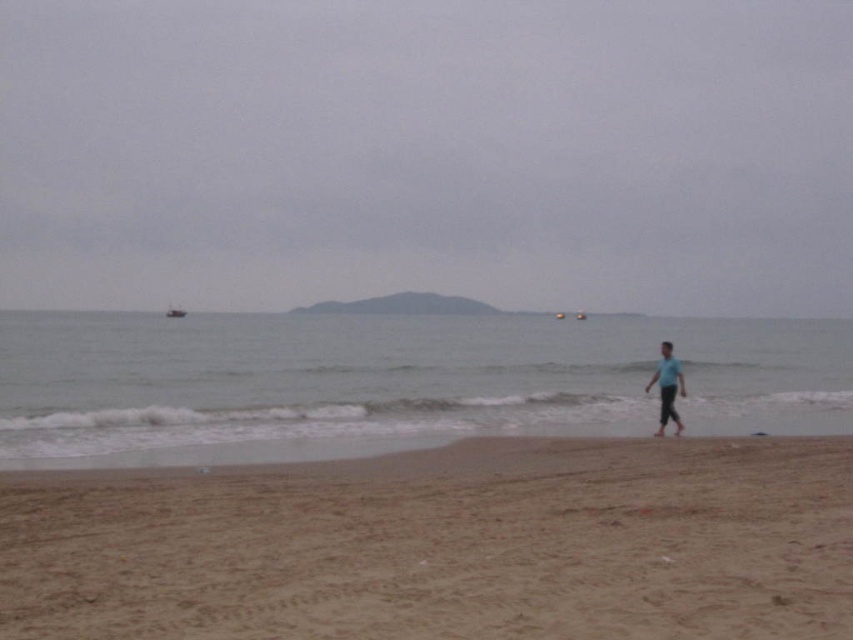
You are standing on the brown sandy beach at lower center and see the blue cotton shirt at lower right. Which object is larger in size?

The brown sandy beach at lower center is bigger than the blue cotton shirt at lower right, so the brown sandy beach at lower center is larger in size.

You are standing on the beach looking out to the ocean. You see the gray matte sky at upper center and the gray matte water at center. Which one is positioned to the right of the other?

The gray matte sky at upper center is positioned to the right of the gray matte water at center.

You are standing at the point marked as point (444, 545). What is the terrain like at that location?

The terrain at point (444, 545) is brown sandy beach at lower center.